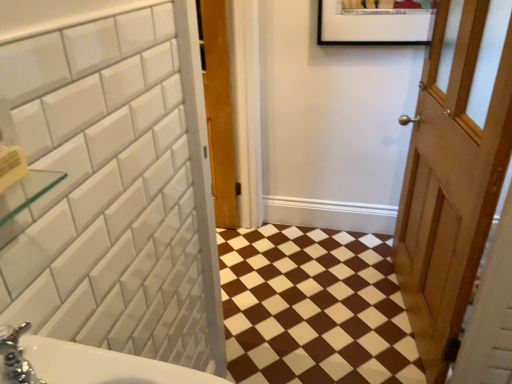
This screenshot has height=384, width=512. In order to click on brown glossy tile at center in this screenshot , I will do `click(313, 308)`.

This screenshot has width=512, height=384. Describe the element at coordinates (313, 308) in the screenshot. I see `brown glossy tile at center` at that location.

The width and height of the screenshot is (512, 384). Describe the element at coordinates (453, 171) in the screenshot. I see `wooden door at right` at that location.

This screenshot has height=384, width=512. I want to click on wooden door at right, so click(453, 171).

At what (x,y) coordinates should I click in order to perform the action: click on brown glossy tile at center. Please return your answer as a coordinate pair (x, y). The image size is (512, 384). Looking at the image, I should click on (313, 308).

Between wooden door at right and brown glossy tile at center, which one appears on the left side from the viewer's perspective?

brown glossy tile at center is more to the left.

Which object is closer to the camera taking this photo, wooden door at right or brown glossy tile at center?

wooden door at right is closer to the camera.

Considering the positions of point (455, 128) and point (328, 235), is point (455, 128) closer or farther from the camera than point (328, 235)?

Clearly, point (455, 128) is closer to the camera than point (328, 235).

From the image's perspective, which one is positioned lower, wooden door at right or brown glossy tile at center?

brown glossy tile at center.

In the scene shown: From a real-world perspective, is wooden door at right physically below brown glossy tile at center?

Incorrect, from a real-world perspective, wooden door at right is higher than brown glossy tile at center.

Which of these two, wooden door at right or brown glossy tile at center, is thinner?

wooden door at right is thinner.

Can you confirm if wooden door at right is taller than brown glossy tile at center?

Indeed, wooden door at right has a greater height compared to brown glossy tile at center.

Considering the sizes of objects wooden door at right and brown glossy tile at center in the image provided, who is bigger, wooden door at right or brown glossy tile at center?

Bigger between the two is wooden door at right.

Is wooden door at right situated inside brown glossy tile at center or outside?

wooden door at right is spatially situated outside brown glossy tile at center.

Is there a large distance between wooden door at right and brown glossy tile at center?

No, wooden door at right is in close proximity to brown glossy tile at center.

Is brown glossy tile at center at the back of wooden door at right?

No, brown glossy tile at center is not at the back of wooden door at right.

This screenshot has width=512, height=384. Find the location of `ceramic tile that appears on the left of wooden door at right`. ceramic tile that appears on the left of wooden door at right is located at coordinates (313, 308).

Is brown glossy tile at center at the left side of wooden door at right?

Yes.

Is brown glossy tile at center closer to camera compared to wooden door at right?

That is False.

Is point (260, 277) positioned before point (435, 370)?

That is False.

Based on the photo, from the image's perspective, is brown glossy tile at center below wooden door at right?

Yes, from the image's perspective, brown glossy tile at center is below wooden door at right.

From a real-world perspective, is brown glossy tile at center physically below wooden door at right?

Yes, from a real-world perspective, brown glossy tile at center is beneath wooden door at right.

Can you confirm if brown glossy tile at center is wider than wooden door at right?

Yes, brown glossy tile at center is wider than wooden door at right.

Consider the image. Is brown glossy tile at center taller or shorter than wooden door at right?

brown glossy tile at center is shorter than wooden door at right.

Considering the relative sizes of brown glossy tile at center and wooden door at right in the image provided, is brown glossy tile at center bigger than wooden door at right?

No.

Can we say brown glossy tile at center lies outside wooden door at right?

Yes, brown glossy tile at center is not within wooden door at right.

Are brown glossy tile at center and wooden door at right making contact?

No, brown glossy tile at center is not beside wooden door at right.

Could you tell me if brown glossy tile at center is facing wooden door at right?

No, brown glossy tile at center is not turned towards wooden door at right.

Can you tell me how much brown glossy tile at center and wooden door at right differ in facing direction?

There is a 80.2-degree angle between the facing directions of brown glossy tile at center and wooden door at right.

Image resolution: width=512 pixels, height=384 pixels. What are the coordinates of `door above the brown glossy tile at center (from the image's perspective)` in the screenshot? It's located at (453, 171).

At what (x,y) coordinates should I click in order to perform the action: click on ceramic tile that appears behind the wooden door at right. Please return your answer as a coordinate pair (x, y). The width and height of the screenshot is (512, 384). Looking at the image, I should click on (313, 308).

In order to click on door above the brown glossy tile at center (from the image's perspective) in this screenshot , I will do `click(453, 171)`.